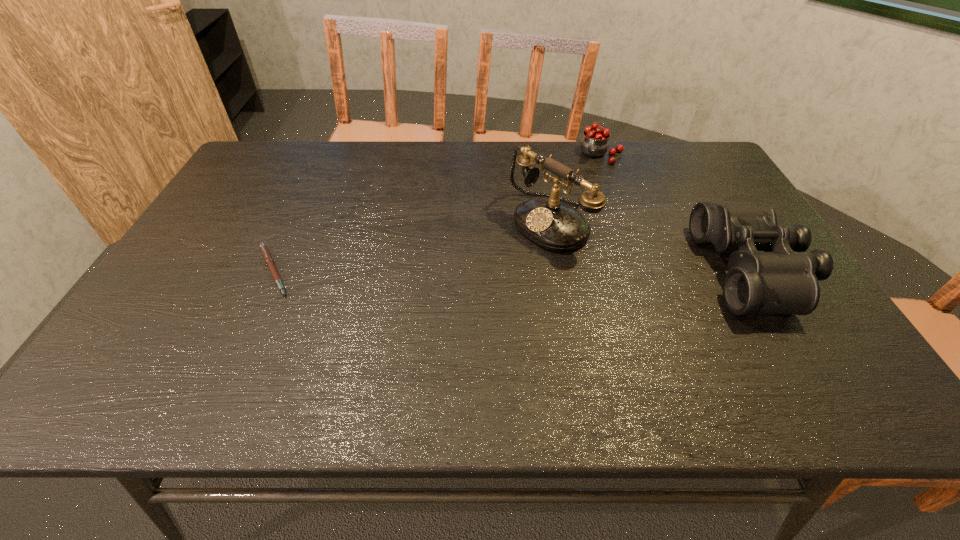
I want to click on vacant space on the desktop that is between the shortest object and the rightmost object and is positioned on the handle side of the farthest object, so click(540, 271).

Locate an element on the screen. Image resolution: width=960 pixels, height=540 pixels. free space on the desktop that is between the leftmost object and the rightmost object and is positioned on the dial of the second object from left to right is located at coordinates (471, 271).